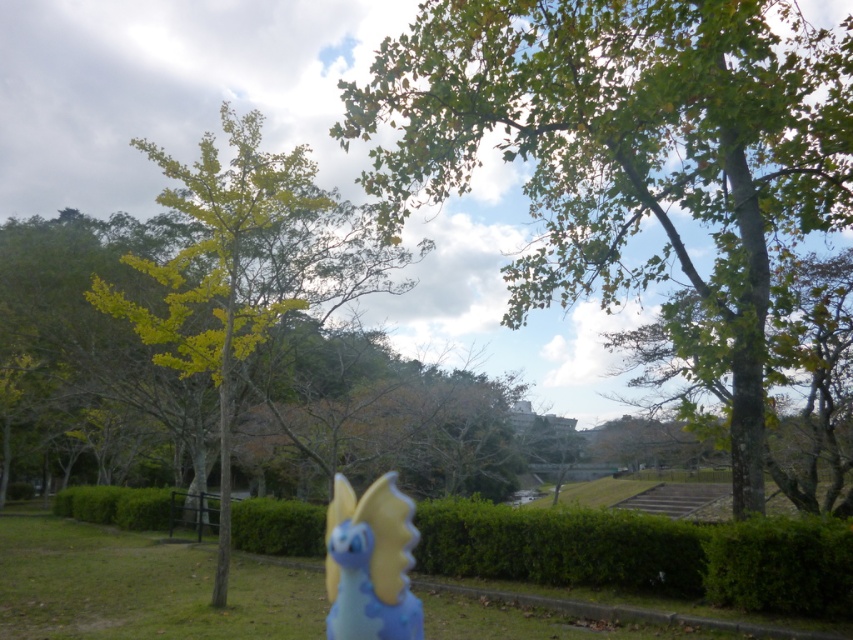
Question: Estimate the real-world distances between objects in this image. Which object is farther from the green hedge at lower center?

Choices:
 (A) blue rubber dragonfly at center
 (B) yellow-green leaves at center
 (C) green leafy tree at upper center

Answer: (A)

Question: Can you confirm if green leafy tree at upper center is bigger than green hedge at lower center?

Choices:
 (A) yes
 (B) no

Answer: (A)

Question: Is green leafy tree at upper center wider than green hedge at lower center?

Choices:
 (A) yes
 (B) no

Answer: (B)

Question: Which point is farther to the camera?

Choices:
 (A) (759, 77)
 (B) (820, 541)
 (C) (341, 522)
 (D) (259, 152)

Answer: (D)

Question: Which of the following is the closest to the observer?

Choices:
 (A) (196, 257)
 (B) (451, 547)
 (C) (352, 609)
 (D) (469, 88)

Answer: (C)

Question: Is yellow-green leaves at center above blue rubber dragonfly at center?

Choices:
 (A) no
 (B) yes

Answer: (B)